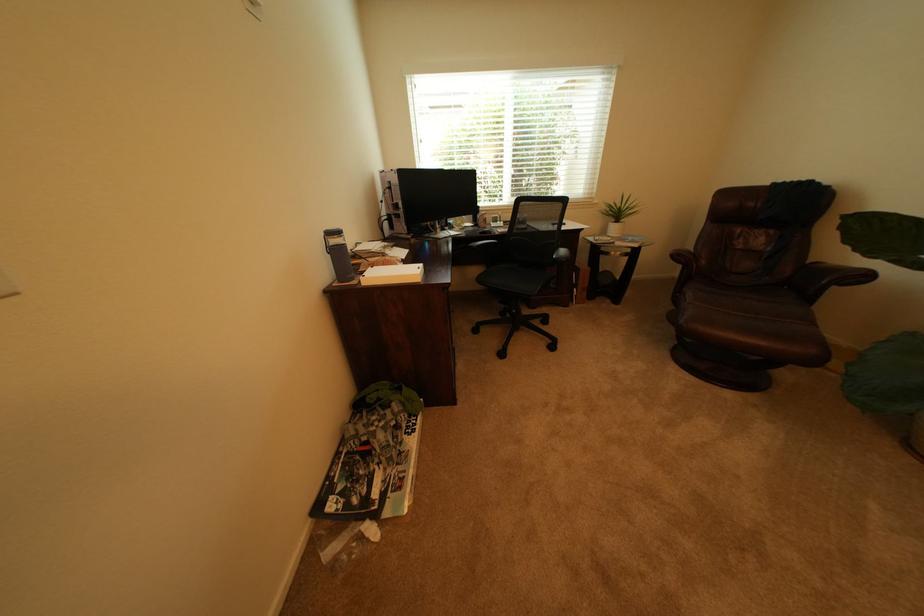
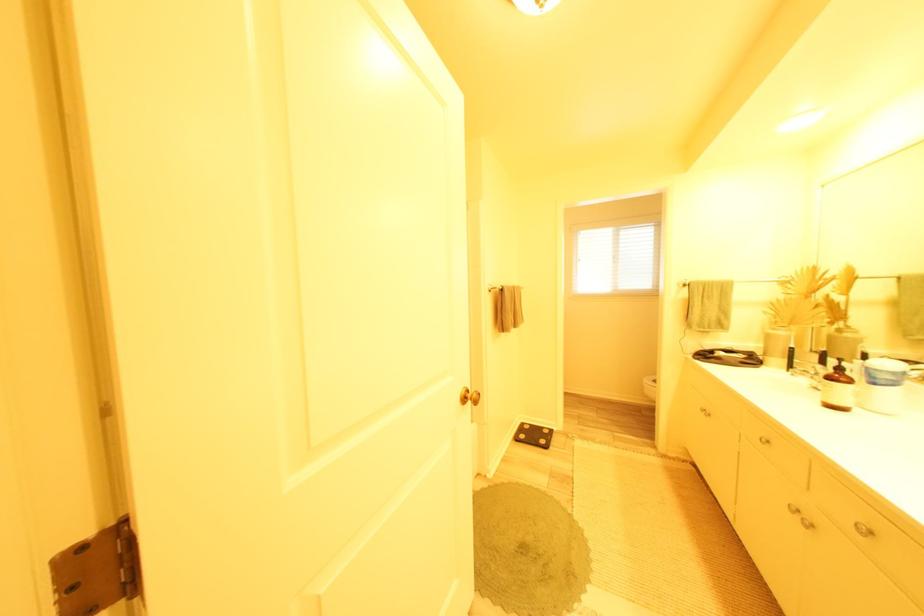
Question: I am providing you with two images of the same scene from different viewpoints. Please identify which objects are invisible in image2.

Choices:
 (A) cabinet knob
 (B) teal blue pillow
 (C) black computer mouse
 (D) blue jar lid

Answer: (C)